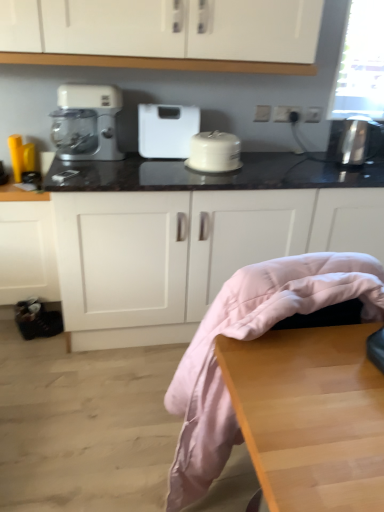
Question: Is wooden table at lower right at the right side of white glossy cake stand at center?

Choices:
 (A) yes
 (B) no

Answer: (A)

Question: Could you tell me if wooden table at lower right is facing white glossy cake stand at center?

Choices:
 (A) no
 (B) yes

Answer: (A)

Question: Is wooden table at lower right not within white glossy cake stand at center?

Choices:
 (A) yes
 (B) no

Answer: (A)

Question: Can you confirm if wooden table at lower right is taller than white glossy cake stand at center?

Choices:
 (A) yes
 (B) no

Answer: (A)

Question: Is wooden table at lower right further to camera compared to white glossy cake stand at center?

Choices:
 (A) no
 (B) yes

Answer: (A)

Question: In terms of width, does matte yellow kettle at left, which is the second appliance from right to left, look wider or thinner when compared to white glossy cake stand at center?

Choices:
 (A) thin
 (B) wide

Answer: (A)

Question: Considering the positions of matte yellow kettle at left, marked as the first appliance in a left-to-right arrangement, and white glossy cake stand at center in the image, is matte yellow kettle at left, marked as the first appliance in a left-to-right arrangement, bigger or smaller than white glossy cake stand at center?

Choices:
 (A) small
 (B) big

Answer: (A)

Question: From their relative heights in the image, would you say matte yellow kettle at left, marked as the first appliance in a left-to-right arrangement, is taller or shorter than white glossy cake stand at center?

Choices:
 (A) short
 (B) tall

Answer: (B)

Question: Is point (21, 167) positioned closer to the camera than point (238, 148)?

Choices:
 (A) closer
 (B) farther

Answer: (A)

Question: From a real-world perspective, is wooden table at lower right physically located above or below matte yellow kettle at left, marked as the first appliance in a left-to-right arrangement?

Choices:
 (A) below
 (B) above

Answer: (A)

Question: Considering the positions of point (329, 408) and point (26, 145), is point (329, 408) closer or farther from the camera than point (26, 145)?

Choices:
 (A) farther
 (B) closer

Answer: (B)

Question: Is wooden table at lower right inside or outside of matte yellow kettle at left, marked as the first appliance in a left-to-right arrangement?

Choices:
 (A) inside
 (B) outside

Answer: (B)

Question: Visually, is wooden table at lower right positioned to the left or to the right of matte yellow kettle at left, which is the second appliance from right to left?

Choices:
 (A) right
 (B) left

Answer: (A)

Question: From a real-world perspective, is white plastic scale at center above or below black marble countertop at center?

Choices:
 (A) above
 (B) below

Answer: (A)

Question: From their relative heights in the image, would you say white plastic scale at center is taller or shorter than black marble countertop at center?

Choices:
 (A) tall
 (B) short

Answer: (B)